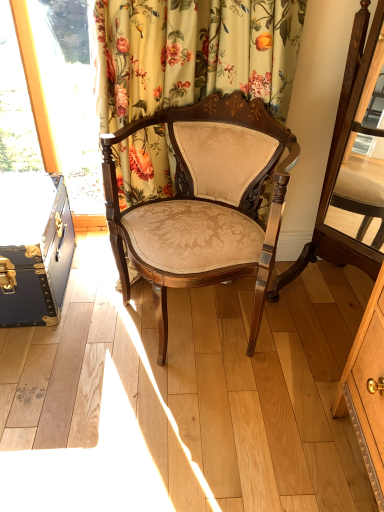
Find the location of a particular element. The height and width of the screenshot is (512, 384). vacant area situated below matte gold upholstery chair at center (from a real-world perspective) is located at coordinates (201, 324).